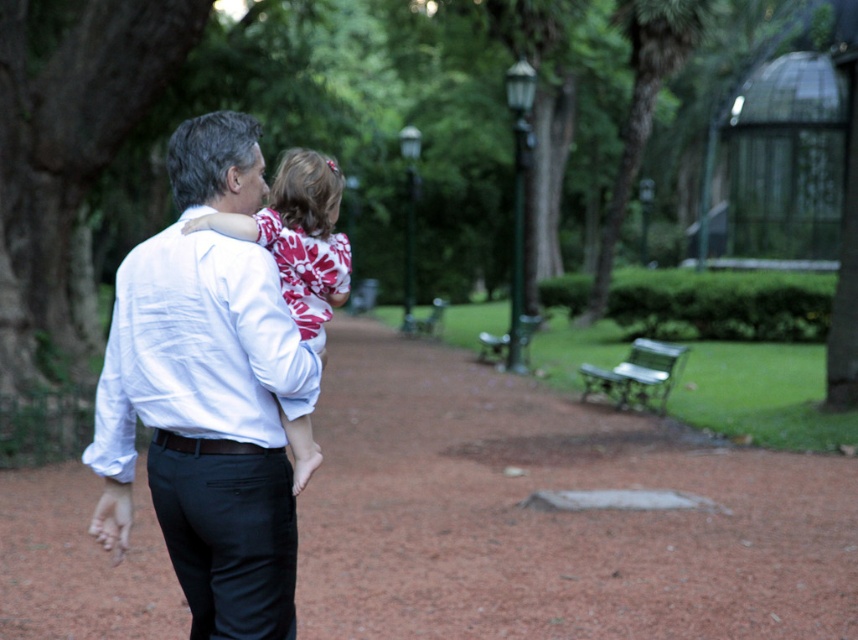
You are standing at the point marked as point (550, 513) in the park. What is located exactly at this point?

The point (550, 513) is where the smooth dirt path at center is located.

You are a person walking along the smooth dirt path at center and want to sit down on the green metal bench at lower right. Which direction should you walk to reach the bench?

The smooth dirt path at center is in front of the green metal bench at lower right, so you should walk forward to reach the bench.